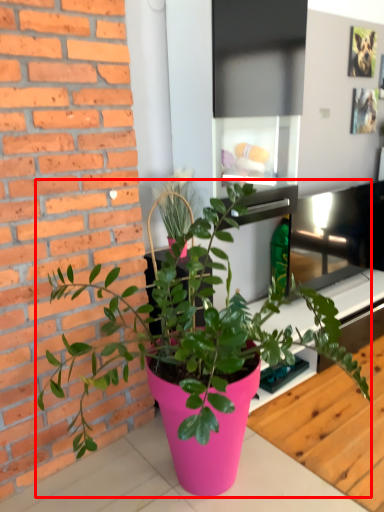
Question: From the image, what is the correct spatial relationship of houseplant (annotated by the red box) in relation to table?

Choices:
 (A) right
 (B) left

Answer: (B)